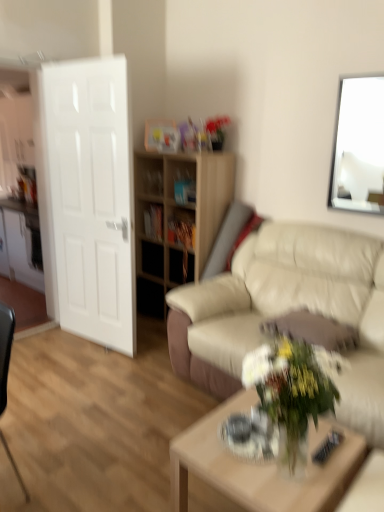
You are a GUI agent. You are given a task and a screenshot of the screen. Output one action in this format:
    pyautogui.click(x=<x>, y=<y>)
    Task: Click on the vacant area that is in front of white glossy door at left
    This screenshot has width=384, height=512.
    Given the screenshot: What is the action you would take?
    pyautogui.click(x=86, y=369)